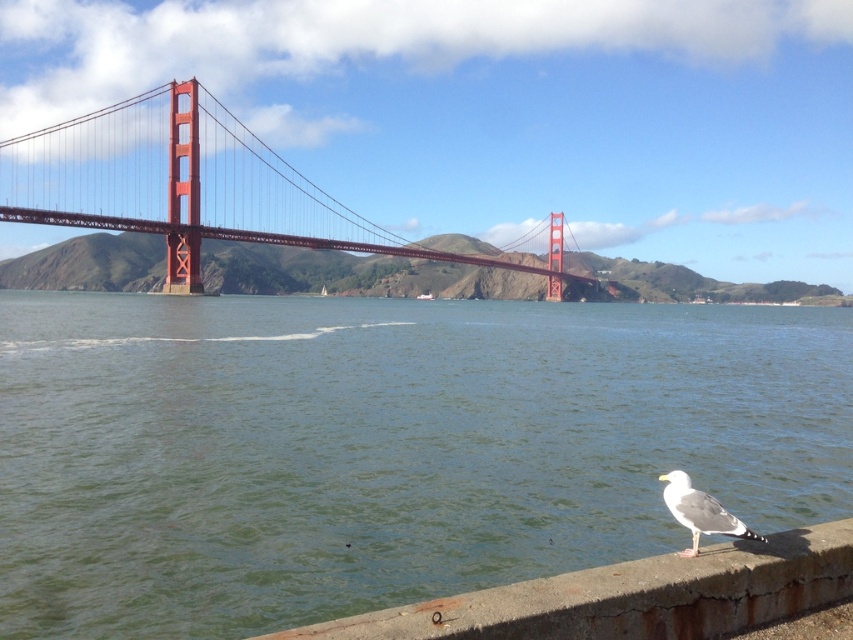
Does green water at lower center appear on the left side of metallic red suspension bridge at upper center?

In fact, green water at lower center is to the right of metallic red suspension bridge at upper center.

Does green water at lower center have a lesser height compared to metallic red suspension bridge at upper center?

Correct, green water at lower center is not as tall as metallic red suspension bridge at upper center.

At what (x,y) coordinates should I click in order to perform the action: click on green water at lower center. Please return your answer as a coordinate pair (x, y). The height and width of the screenshot is (640, 853). Looking at the image, I should click on (381, 449).

Does point (91, 166) come farther from viewer compared to point (704, 547)?

Yes, it is.

This screenshot has width=853, height=640. Describe the element at coordinates (206, 188) in the screenshot. I see `metallic red suspension bridge at upper center` at that location.

Locate an element on the screen. Image resolution: width=853 pixels, height=640 pixels. metallic red suspension bridge at upper center is located at coordinates (206, 188).

Which is below, green water at lower center or white feathered seagull at lower right?

Positioned lower is white feathered seagull at lower right.

Locate an element on the screen. This screenshot has height=640, width=853. green water at lower center is located at coordinates (381, 449).

Which is in front, point (560, 492) or point (706, 532)?

Positioned in front is point (706, 532).

Identify the location of green water at lower center. This screenshot has width=853, height=640. (381, 449).